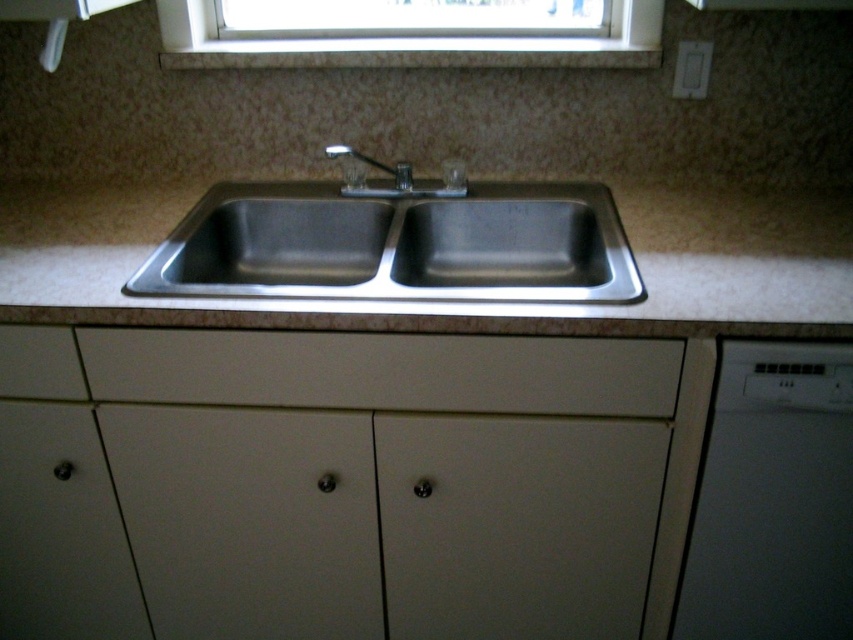
Question: Where is white plastic dishwasher at right located in relation to satin nickel faucet at center in the image?

Choices:
 (A) above
 (B) below

Answer: (B)

Question: Is white matte drawer at lower left positioned at the back of satin nickel faucet at center?

Choices:
 (A) yes
 (B) no

Answer: (B)

Question: Which is nearer to the stainless steel sink at center?

Choices:
 (A) white matte drawer at lower left
 (B) white plastic dishwasher at right
 (C) clear glass window at upper center
 (D) white matte drawer at center

Answer: (D)

Question: Which of the following is the closest to the observer?

Choices:
 (A) 368,156
 (B) 726,572
 (C) 216,253

Answer: (B)

Question: Is white matte drawer at lower left bigger than satin nickel faucet at center?

Choices:
 (A) no
 (B) yes

Answer: (A)

Question: Considering the real-world distances, which object is farthest from the white matte drawer at lower left?

Choices:
 (A) satin nickel faucet at center
 (B) white matte drawer at center
 (C) clear glass window at upper center
 (D) white plastic dishwasher at right

Answer: (D)